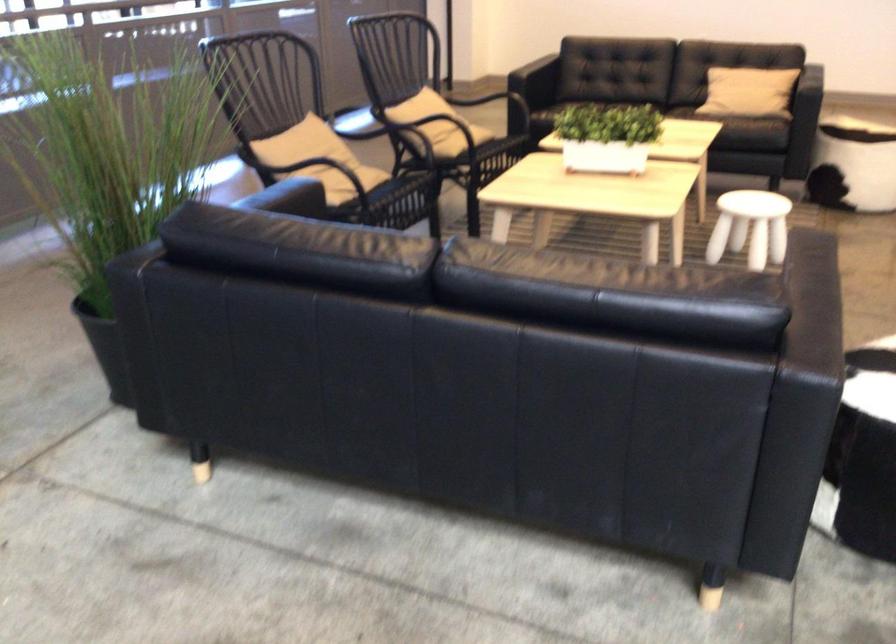
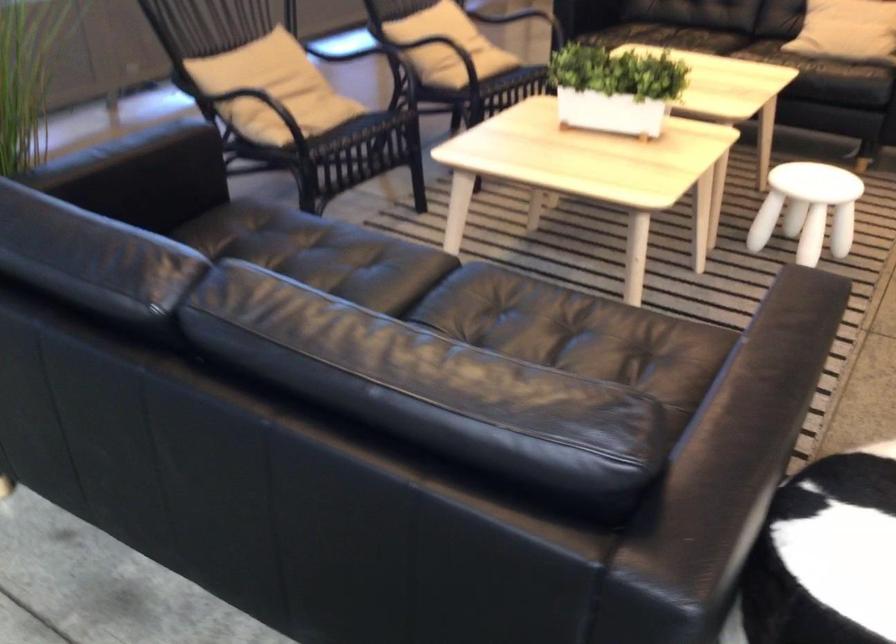
What movement of the cameraman would produce the second image?

The cameraman walked toward right, forward.